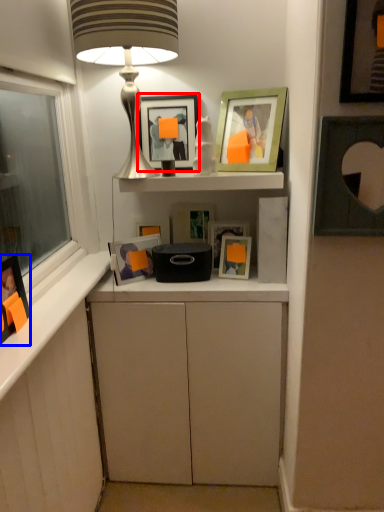
Question: Which object appears farthest to the camera in this image, picture frame (highlighted by a red box) or picture frame (highlighted by a blue box)?

Choices:
 (A) picture frame
 (B) picture frame

Answer: (A)